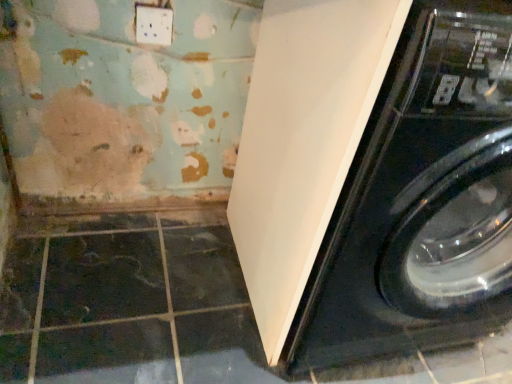
Question: Considering the positions of white glossy washing machine at lower right and white plastic electric outlet at upper center in the image, is white glossy washing machine at lower right wider or thinner than white plastic electric outlet at upper center?

Choices:
 (A) wide
 (B) thin

Answer: (A)

Question: Considering their positions, is white glossy washing machine at lower right located in front of or behind white plastic electric outlet at upper center?

Choices:
 (A) front
 (B) behind

Answer: (A)

Question: Is point (370, 77) positioned closer to the camera than point (152, 23)?

Choices:
 (A) farther
 (B) closer

Answer: (B)

Question: Is point (137, 11) closer or farther from the camera than point (488, 82)?

Choices:
 (A) farther
 (B) closer

Answer: (A)

Question: Relative to white glossy washing machine at lower right, is white plastic electric outlet at upper center in front or behind?

Choices:
 (A) behind
 (B) front

Answer: (A)

Question: From the image's perspective, is white plastic electric outlet at upper center positioned above or below white glossy washing machine at lower right?

Choices:
 (A) above
 (B) below

Answer: (A)

Question: From a real-world perspective, is white plastic electric outlet at upper center physically located above or below white glossy washing machine at lower right?

Choices:
 (A) above
 (B) below

Answer: (A)